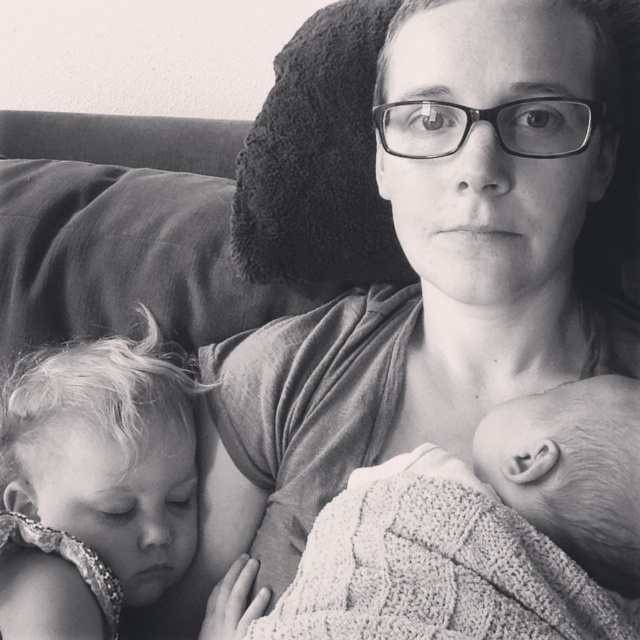
Question: Can you confirm if matte gray shirt at center is wider than knitted fabric baby at center?

Choices:
 (A) yes
 (B) no

Answer: (A)

Question: Among these points, which one is farthest from the camera?

Choices:
 (A) (525, 339)
 (B) (332, 560)

Answer: (A)

Question: Which point is closer to the camera taking this photo?

Choices:
 (A) (380, 392)
 (B) (592, 456)

Answer: (B)

Question: Is matte gray shirt at center bigger than knitted fabric baby at center?

Choices:
 (A) no
 (B) yes

Answer: (B)

Question: From the image, what is the correct spatial relationship of matte gray shirt at center in relation to knitted fabric baby at center?

Choices:
 (A) left
 (B) right

Answer: (A)

Question: Which point is closer to the camera?

Choices:
 (A) knitted fabric baby at center
 (B) matte gray shirt at center

Answer: (A)